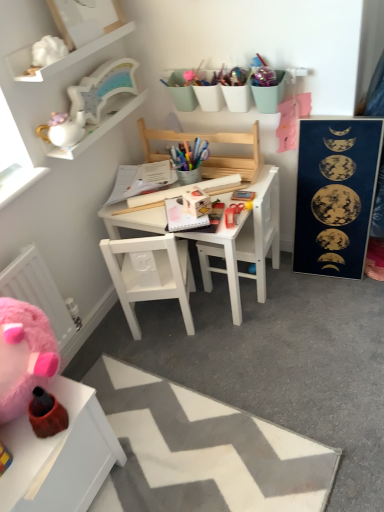
This screenshot has height=512, width=384. I want to click on free space in front of blue matte poster at right, so pyautogui.click(x=339, y=303).